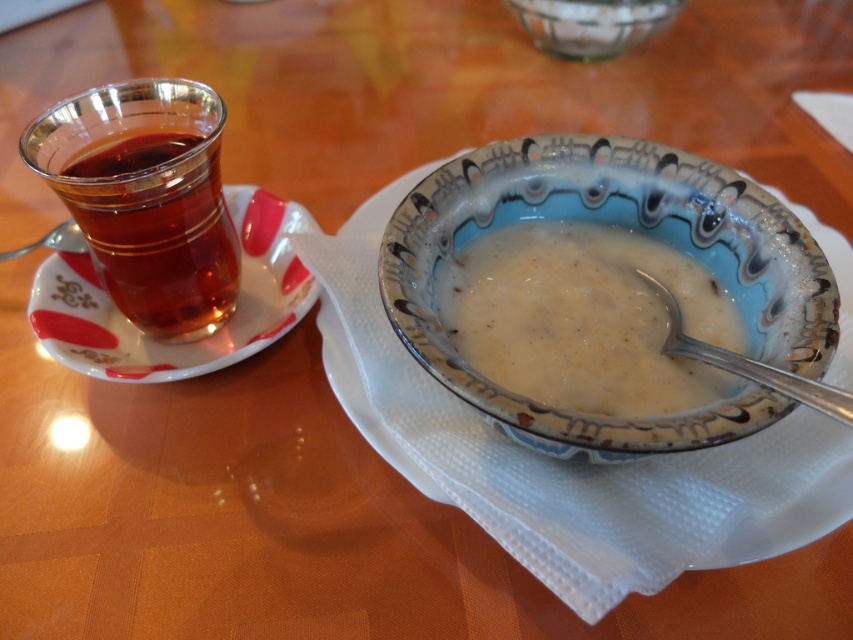
From the picture: You are a guest at a dinner party and see the silver metallic spoon at bowl center and the metallic silver spoon at left on the table. Which spoon is closer to you?

The silver metallic spoon at bowl center is positioned under the metallic silver spoon at left, so the metallic silver spoon at left is closer to you.

You are a server in a restaurant and need to place a 20 inch long tray between the porcelain bowl at center and the metallic silver spoon at left. Will the tray fit between them?

The distance between the porcelain bowl at center and the metallic silver spoon at left is 19.92 inches, so the 20 inch long tray will not fit between them as it is slightly longer than the available space.